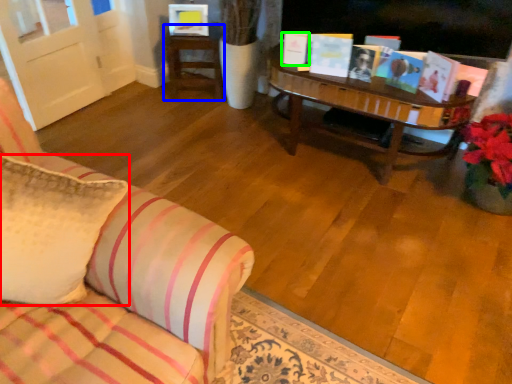
Question: Based on their relative distances, which object is farther from pillow (highlighted by a red box)? Choose from table (highlighted by a blue box) and book (highlighted by a green box).

Choices:
 (A) table
 (B) book

Answer: (A)